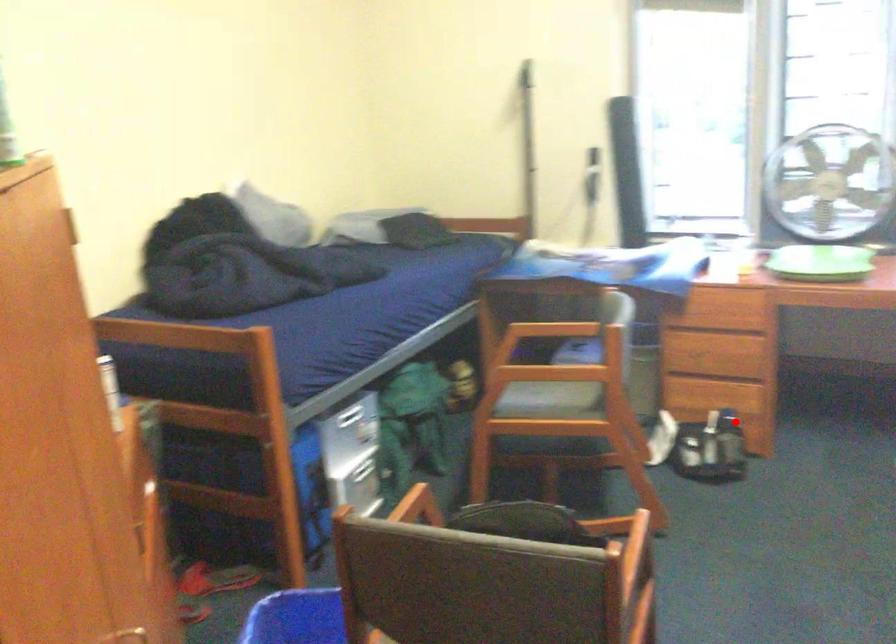
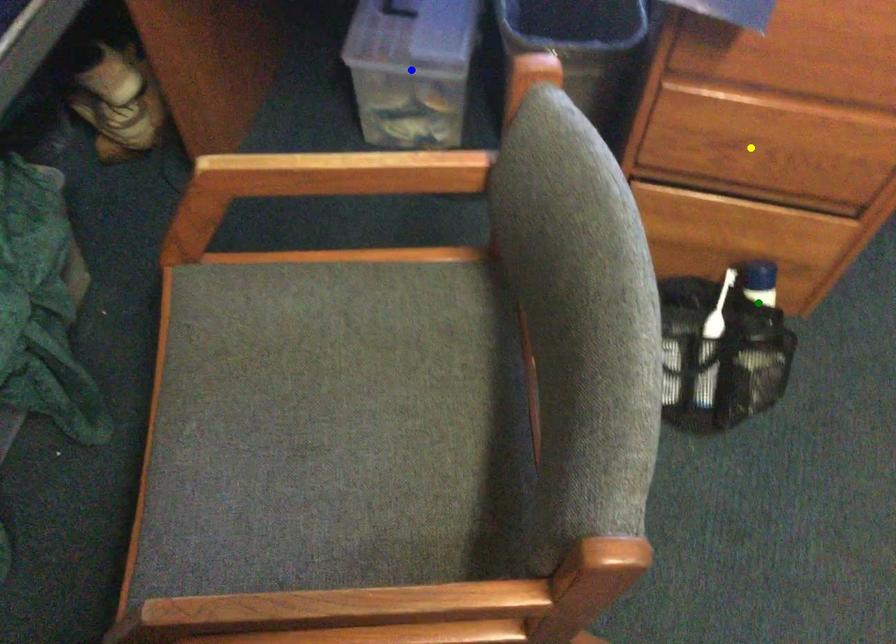
Question: I am providing you with two images of the same scene from different viewpoints. A red point is marked on the first image. You are given multiple points on the second image. Which mark in image 2 goes with the point in image 1?

Choices:
 (A) blue point
 (B) yellow point
 (C) green point

Answer: (C)